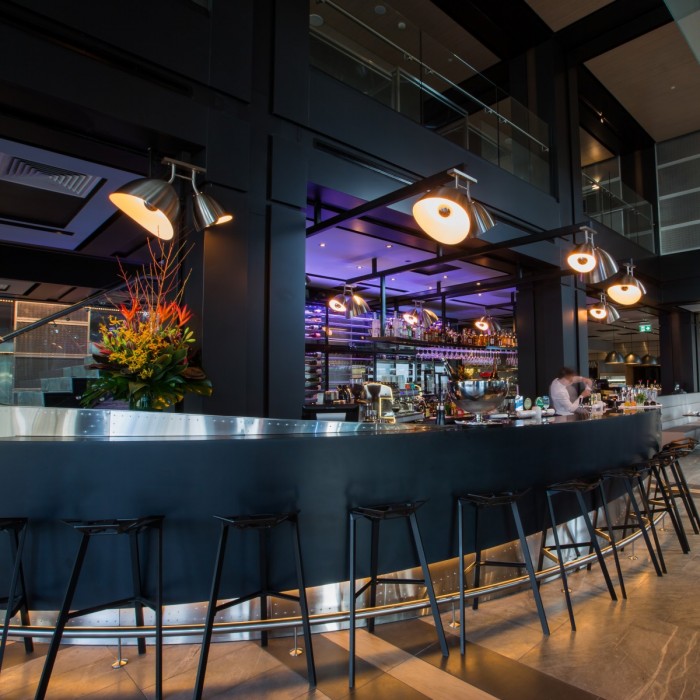
This screenshot has width=700, height=700. What are the coordinates of `overhead lighting` in the screenshot? It's located at (152, 204), (442, 216), (582, 260), (631, 290), (602, 311).